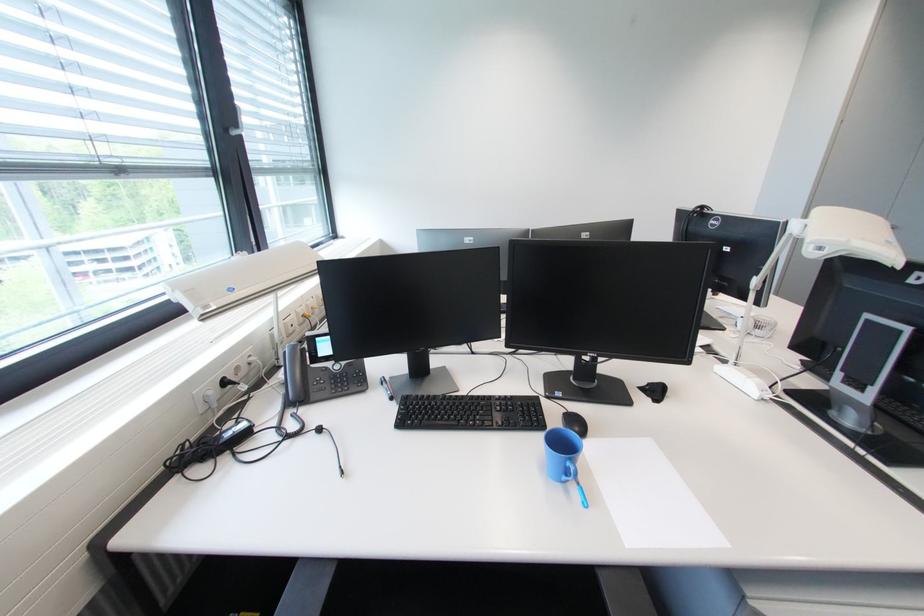
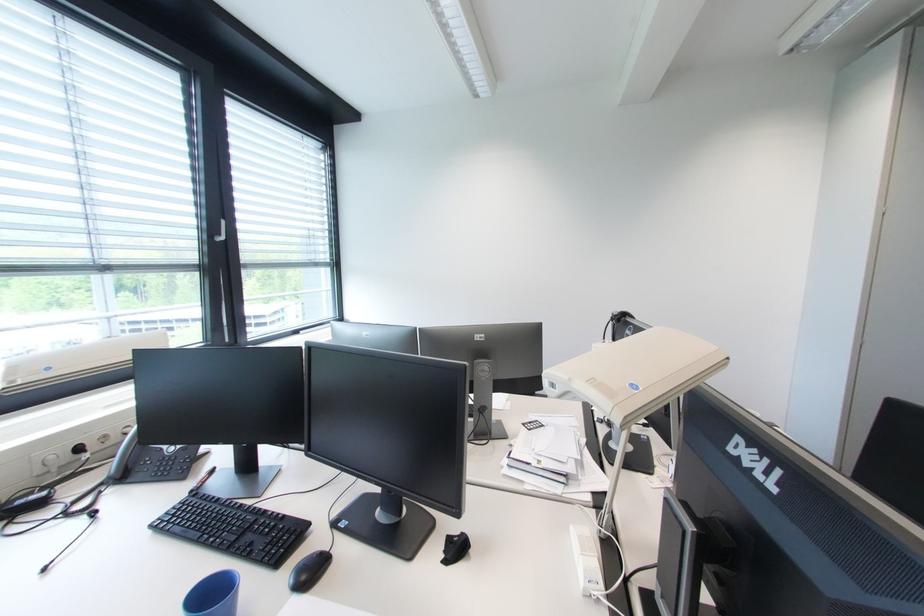
Question: In a continuous first-person perspective shot, in which direction is the camera moving?

Choices:
 (A) Left
 (B) Right
 (C) Forward
 (D) Backward

Answer: (B)